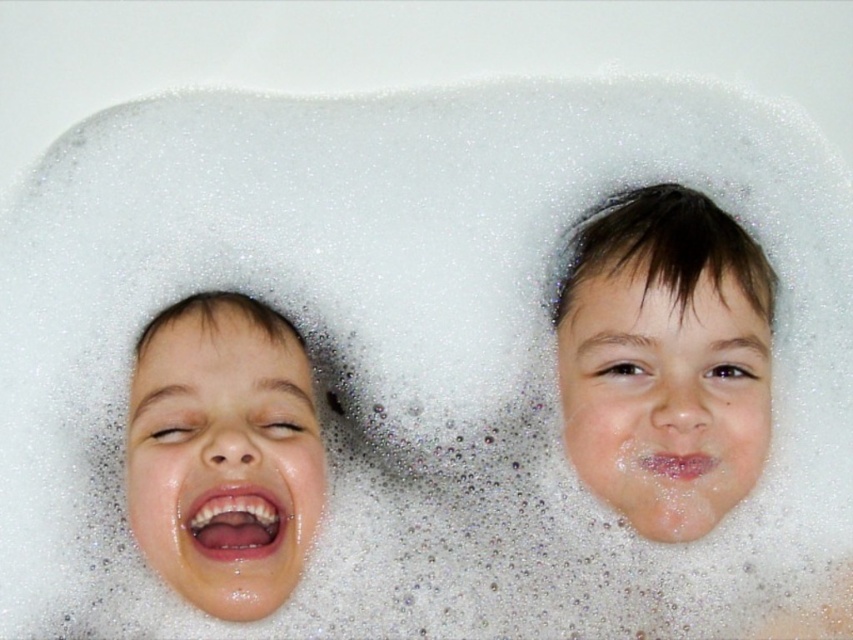
You are a photographer trying to capture both the smooth skin face at upper center and the smooth skin face at left in a single shot. Given that your camera can only focus on one face at a time, which face should you prioritize to ensure it fills the frame adequately?

The smooth skin face at upper center is larger in size than the smooth skin face at left, so you should prioritize focusing on the smooth skin face at upper center to ensure it fills the frame adequately.

You are a photographer trying to capture a closeup of the smooth skin face at upper center and the smooth skin face at left. Which face should you focus on first to ensure it appears sharp in the photo?

You should focus on the smooth skin face at upper center first because it is closer to the viewer than the smooth skin face at left, making it the priority for sharpness in the photo.

You are a photographer trying to capture the best shot of the children in the bathtub. You notice a point at coordinates (x=665, y=358) which marks a smooth skin face at upper center. Can you identify which child this point corresponds to?

The point at coordinates (x=665, y=358) marks the smooth skin face at upper center, which corresponds to the child on the right.